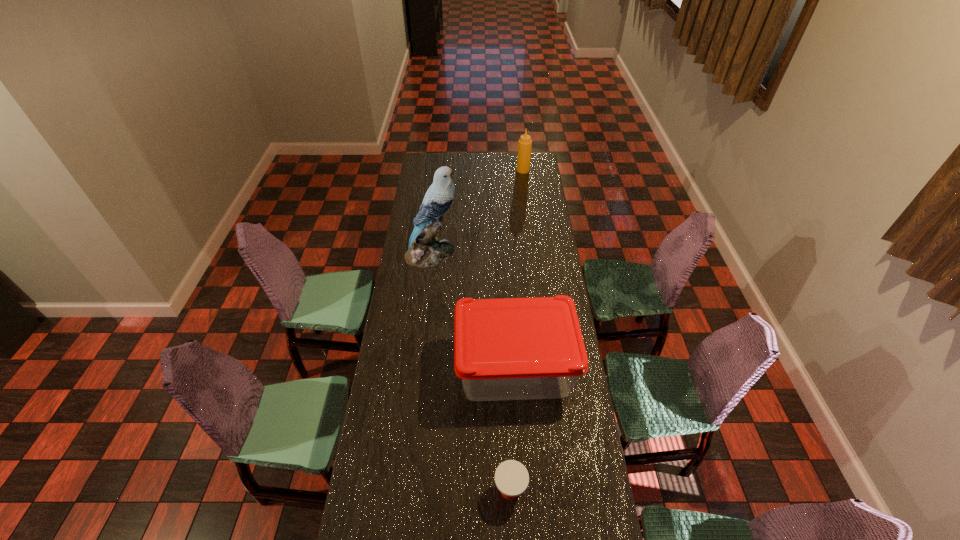
Identify the location of object located at the far edge. (525, 143).

Locate an element on the screen. object located in the left edge section of the desktop is located at coordinates (424, 249).

Where is `condiment that is at the right edge`? The image size is (960, 540). condiment that is at the right edge is located at coordinates (525, 143).

I want to click on tray that is positioned at the right edge, so click(513, 348).

Where is `object that is at the far right corner`? This screenshot has width=960, height=540. object that is at the far right corner is located at coordinates (525, 143).

This screenshot has height=540, width=960. I want to click on free space at the left edge of the desktop, so click(430, 298).

At what (x,y) coordinates should I click in order to perform the action: click on vacant space at the right edge. Please return your answer as a coordinate pair (x, y). The image size is (960, 540). Looking at the image, I should click on (581, 490).

This screenshot has width=960, height=540. Find the location of `vacant space at the far left corner of the desktop`. vacant space at the far left corner of the desktop is located at coordinates (443, 156).

Locate an element on the screen. blank space at the far right corner of the desktop is located at coordinates (533, 168).

Where is `free area in between the parakeet and the condiment`? This screenshot has width=960, height=540. free area in between the parakeet and the condiment is located at coordinates (477, 212).